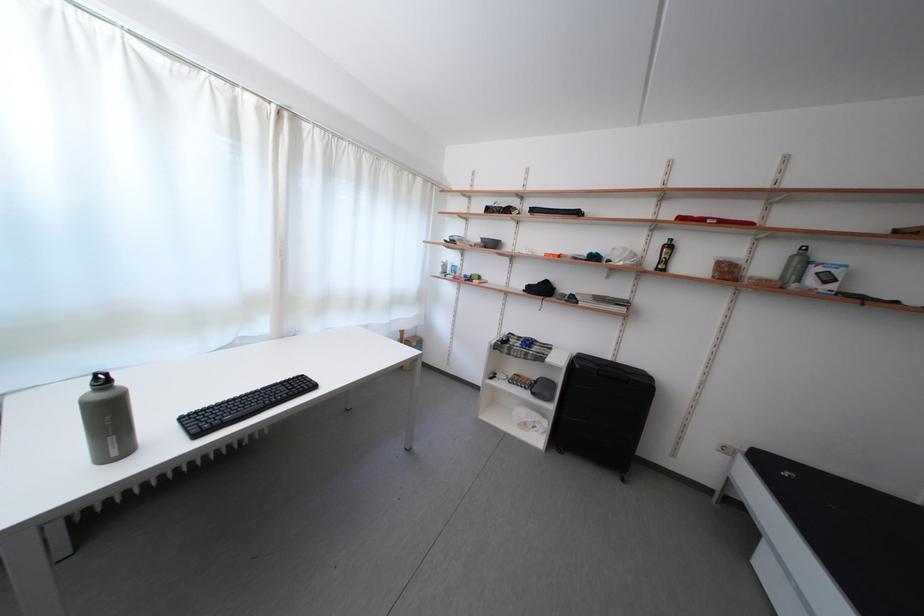
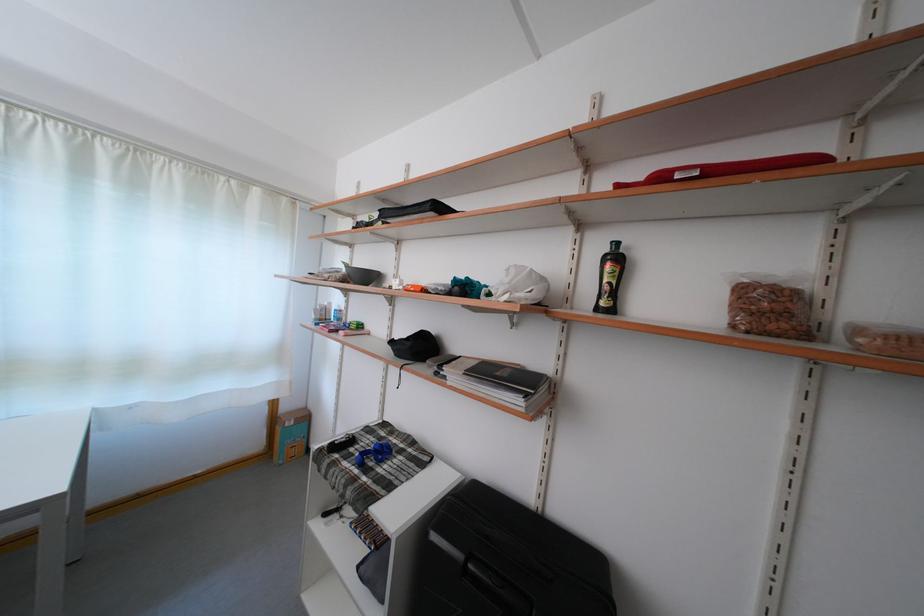
In a continuous first-person perspective shot, in which direction is the camera moving?

The cameraman moved toward right, forward.